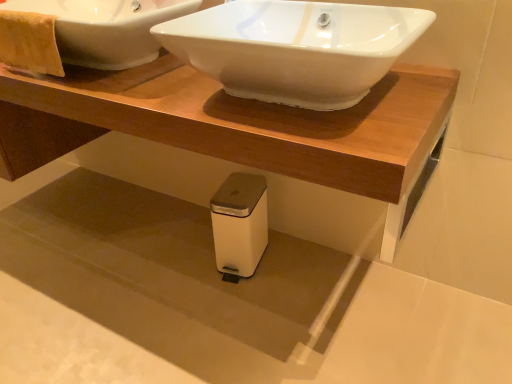
You are a GUI agent. You are given a task and a screenshot of the screen. Output one action in this format:
    pyautogui.click(x=<x>, y=<y>)
    Task: Click on the vacant location below white glossy sink at upper center, marked as the 1th sink in a right-to-left arrangement (from a real-world perspective)
    
    Given the screenshot: What is the action you would take?
    pyautogui.click(x=283, y=105)